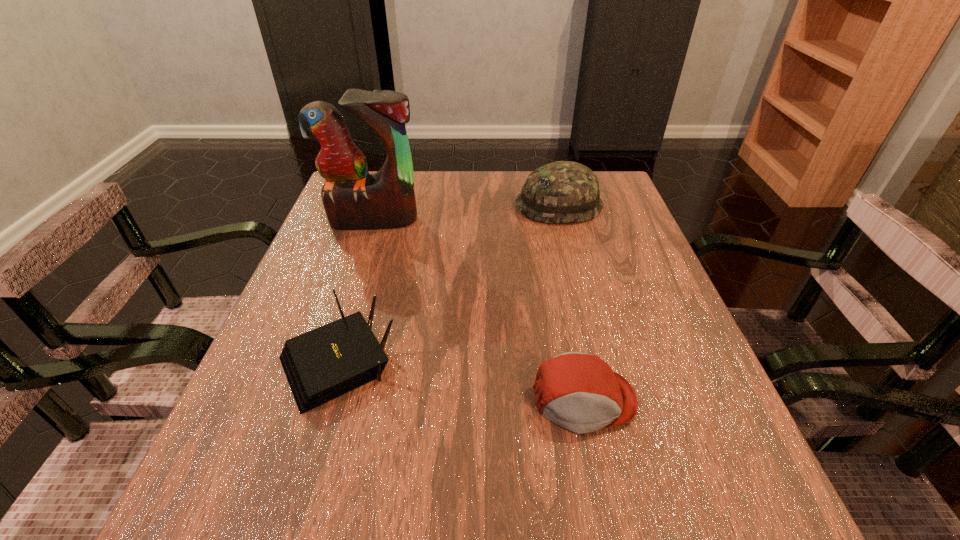
I want to click on vacant space that is in between the router and the taller cap, so click(x=448, y=284).

You are a GUI agent. You are given a task and a screenshot of the screen. Output one action in this format:
    pyautogui.click(x=<x>, y=<y>)
    Task: Click on the vacant space in between the tallest object and the shorter cap
    
    Given the screenshot: What is the action you would take?
    pyautogui.click(x=479, y=310)

Where is `free space between the parrot and the shorter cap`? The width and height of the screenshot is (960, 540). free space between the parrot and the shorter cap is located at coordinates (479, 310).

Find the location of a particular element. This screenshot has width=960, height=540. vacant space that is in between the tallest object and the router is located at coordinates (355, 291).

At what (x,y) coordinates should I click in order to perform the action: click on empty space between the nearer cap and the taller cap. Please return your answer as a coordinate pair (x, y). Looking at the image, I should click on (571, 303).

I want to click on vacant point located between the tallest object and the shorter cap, so coord(479,310).

I want to click on free space between the nearer cap and the router, so [x=461, y=381].

Find the location of `free space between the router and the parrot`. free space between the router and the parrot is located at coordinates (355, 291).

At what (x,y) coordinates should I click in order to perform the action: click on free space between the router and the nearer cap. Please return your answer as a coordinate pair (x, y). Image resolution: width=960 pixels, height=540 pixels. Looking at the image, I should click on (461, 381).

Locate which object is the second closest to the shorter cap. Please provide its 2D coordinates. Your answer should be formatted as a tuple, i.e. [(x, y)], where the tuple contains the x and y coordinates of a point satisfying the conditions above.

[(564, 191)]